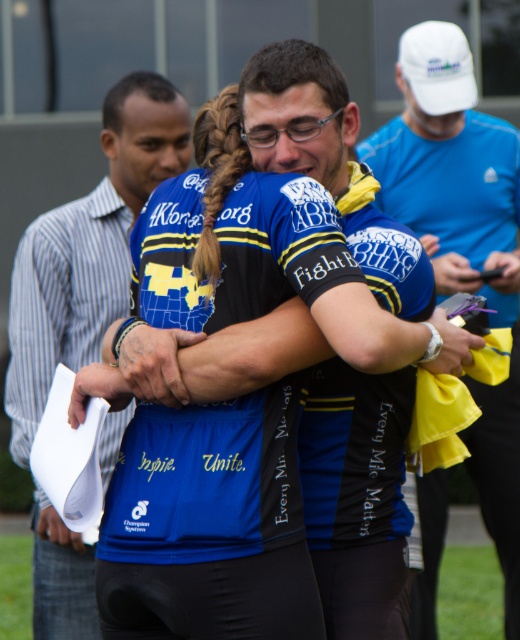
You are organizing a group photo for a cycling team and need to ensure everyone can fit in the frame. The photographer mentions that the camera can capture a maximum distance of 2 meters between the closest and farthest subjects. Given the current positions of the blue jersey at left and blue jersey at center, will they fit within the camera frame?

The blue jersey at left is 2.04 meters from the blue jersey at center. Since the maximum distance the camera can capture is 2 meters, they will not fit within the camera frame as the distance exceeds the limit.

You are standing in front of the image and want to know which of the two points, point (486, 186) or point (339, 545), is closer to you. Based on the scene description, can you determine which point is nearer?

Point (486, 186) is further to the camera than point (339, 545), so the closer point to you is point (339, 545).